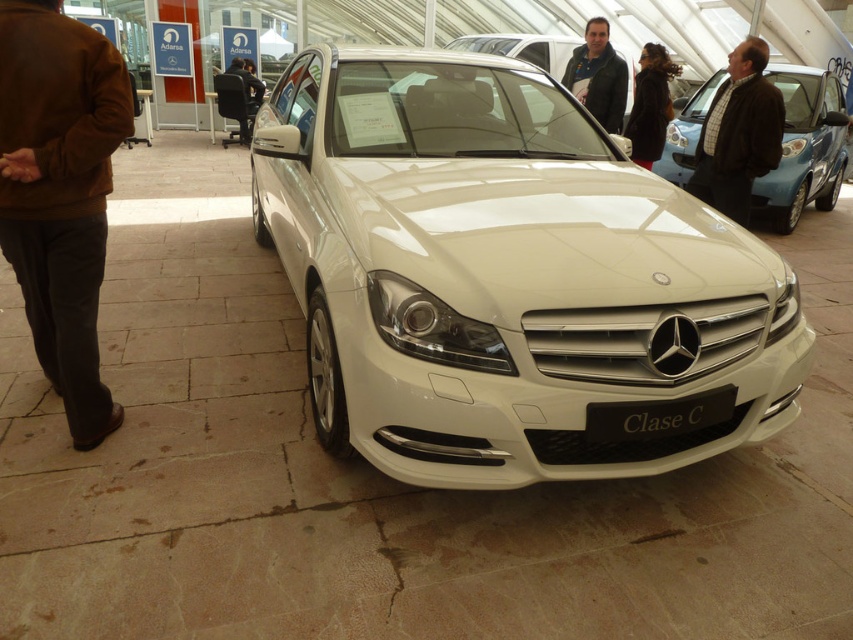
Question: Is matte blue car at right to the left of black fur coat at upper center from the viewer's perspective?

Choices:
 (A) no
 (B) yes

Answer: (A)

Question: Estimate the real-world distances between objects in this image. Which object is farther from the white glossy car at center?

Choices:
 (A) brown plaid shirt at center
 (B) matte blue car at right

Answer: (B)

Question: Which point is closer to the camera taking this photo?

Choices:
 (A) (834, 83)
 (B) (767, 108)
 (C) (469, 170)
 (D) (627, 134)

Answer: (C)

Question: Which of these objects is positioned closest to the dark brown leather jacket at center?

Choices:
 (A) matte blue car at right
 (B) black matte license plate at center
 (C) white glossy car at center

Answer: (C)

Question: From the image, what is the correct spatial relationship of white glossy car at center in relation to brown suede jacket at left?

Choices:
 (A) below
 (B) above

Answer: (B)

Question: In this image, where is white glossy car at center located relative to brown plaid shirt at center?

Choices:
 (A) left
 (B) right

Answer: (A)